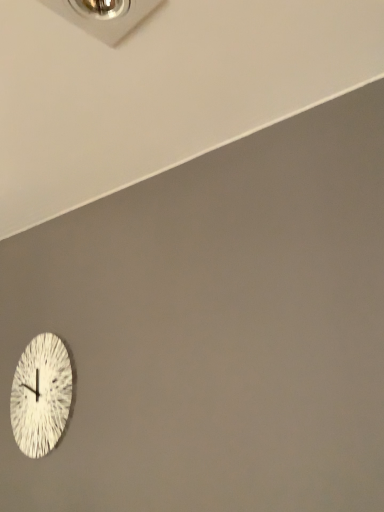
Question: Can you confirm if metallic silver outlet at upper center is wider than white textured clock at lower left?

Choices:
 (A) yes
 (B) no

Answer: (A)

Question: Is metallic silver outlet at upper center in contact with white textured clock at lower left?

Choices:
 (A) yes
 (B) no

Answer: (B)

Question: Can you confirm if metallic silver outlet at upper center is thinner than white textured clock at lower left?

Choices:
 (A) yes
 (B) no

Answer: (B)

Question: Is metallic silver outlet at upper center outside white textured clock at lower left?

Choices:
 (A) yes
 (B) no

Answer: (A)

Question: From a real-world perspective, is metallic silver outlet at upper center positioned under white textured clock at lower left based on gravity?

Choices:
 (A) yes
 (B) no

Answer: (B)

Question: Does metallic silver outlet at upper center have a smaller size compared to white textured clock at lower left?

Choices:
 (A) yes
 (B) no

Answer: (A)

Question: Does white textured clock at lower left have a lesser height compared to metallic silver outlet at upper center?

Choices:
 (A) yes
 (B) no

Answer: (B)

Question: Is white textured clock at lower left looking in the opposite direction of metallic silver outlet at upper center?

Choices:
 (A) no
 (B) yes

Answer: (A)

Question: From a real-world perspective, is white textured clock at lower left positioned under metallic silver outlet at upper center based on gravity?

Choices:
 (A) no
 (B) yes

Answer: (B)

Question: Is white textured clock at lower left taller than metallic silver outlet at upper center?

Choices:
 (A) no
 (B) yes

Answer: (B)

Question: Is white textured clock at lower left further to the viewer compared to metallic silver outlet at upper center?

Choices:
 (A) no
 (B) yes

Answer: (B)

Question: Does white textured clock at lower left have a greater width compared to metallic silver outlet at upper center?

Choices:
 (A) yes
 (B) no

Answer: (B)

Question: Looking at the image, does metallic silver outlet at upper center seem bigger or smaller compared to white textured clock at lower left?

Choices:
 (A) big
 (B) small

Answer: (B)